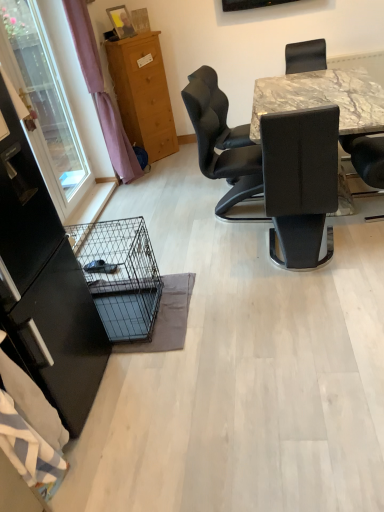
Question: Considering the positions of marble table at upper right and black leather chair at center in the image, is marble table at upper right wider or thinner than black leather chair at center?

Choices:
 (A) wide
 (B) thin

Answer: (A)

Question: Based on their sizes in the image, would you say marble table at upper right is bigger or smaller than black leather chair at center?

Choices:
 (A) big
 (B) small

Answer: (A)

Question: Which object is positioned farthest from the marble table at upper right?

Choices:
 (A) transparent plastic window screen at left
 (B) transparent glass screen door at left
 (C) black leather chair at center
 (D) black wire mesh cage at lower left
 (E) wooden cabinet at upper left

Answer: (B)

Question: Considering the real-world distances, which object is closest to the transparent plastic window screen at left?

Choices:
 (A) black wire mesh cage at lower left
 (B) purple fabric curtain at left
 (C) black leather chair at center
 (D) wooden cabinet at upper left
 (E) marble table at upper right

Answer: (B)